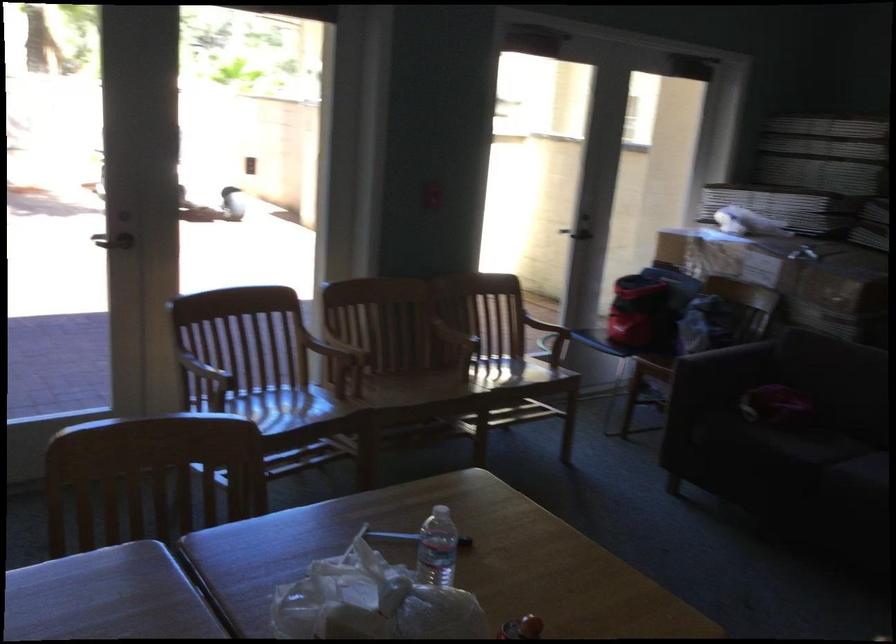
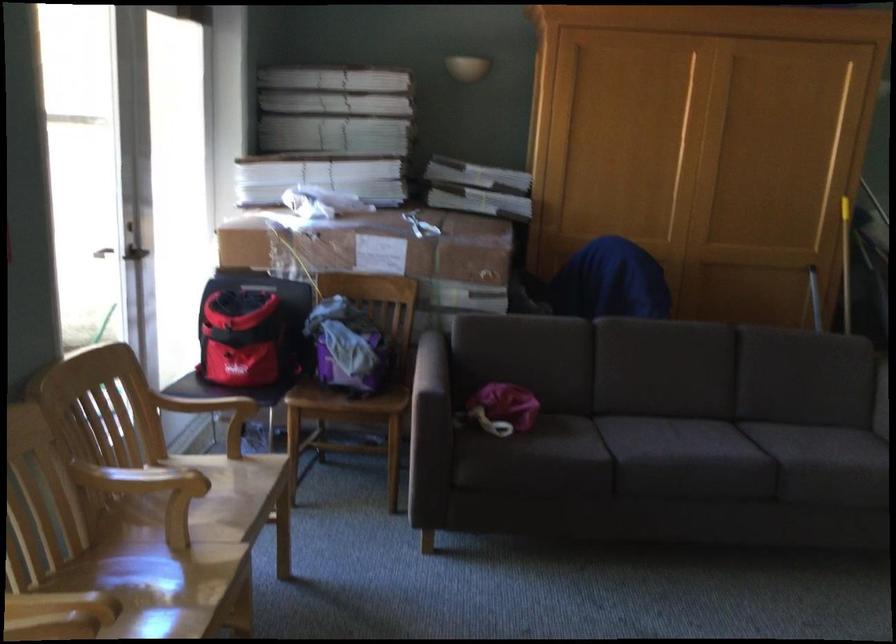
Find the pixel in the second image that matches [453,386] in the first image.

(169, 590)